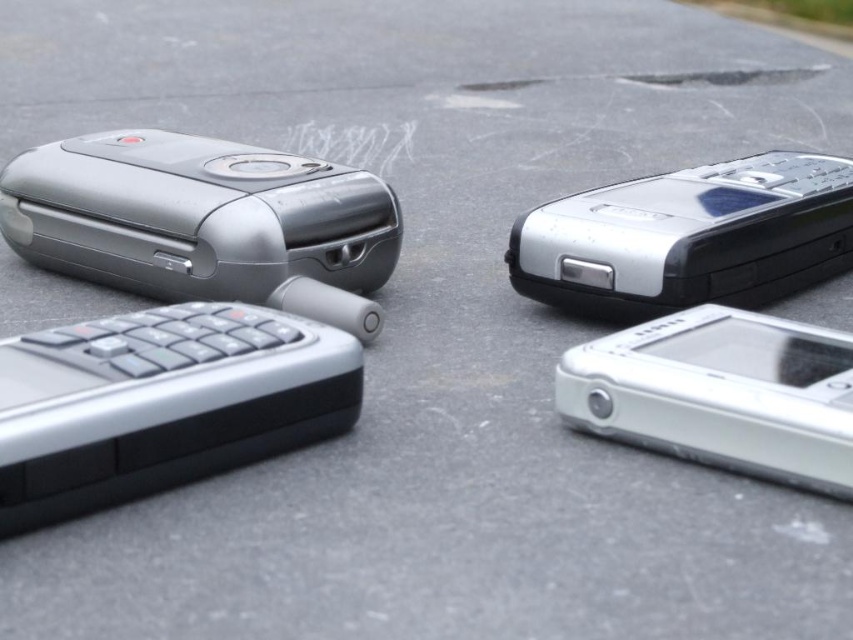
Question: Considering the relative positions of satin silver phone at upper right and sleek silver phone at lower right in the image provided, where is satin silver phone at upper right located with respect to sleek silver phone at lower right?

Choices:
 (A) left
 (B) right

Answer: (B)

Question: Which is nearer to the sleek silver phone at lower right?

Choices:
 (A) satin silver flip phone at upper left
 (B) satin silver phone at upper right

Answer: (B)

Question: Can you confirm if satin silver phone at upper right is positioned above sleek silver phone at lower right?

Choices:
 (A) yes
 (B) no

Answer: (A)

Question: Does satin silver phone at upper right have a larger size compared to sleek silver phone at lower right?

Choices:
 (A) yes
 (B) no

Answer: (A)

Question: Which point is closer to the camera?

Choices:
 (A) (248, 195)
 (B) (769, 349)
 (C) (726, 172)

Answer: (B)

Question: Which point is farther to the camera?

Choices:
 (A) (746, 256)
 (B) (695, 310)

Answer: (A)